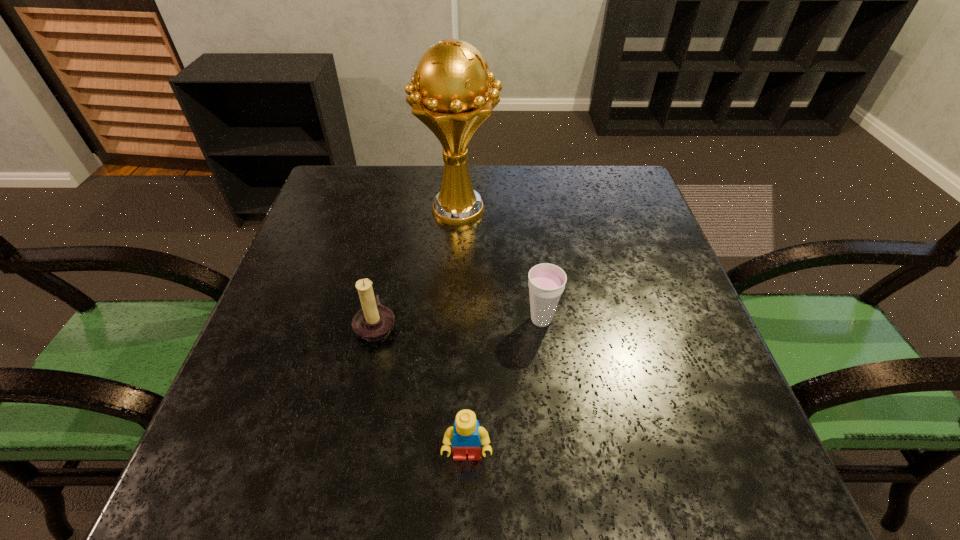
I want to click on vacant space at the far edge of the desktop, so click(491, 204).

The height and width of the screenshot is (540, 960). In the image, there is a desktop. Identify the location of free space at the near edge. (637, 480).

Find the location of a particular element. The width and height of the screenshot is (960, 540). blank area at the left edge is located at coordinates (367, 230).

Image resolution: width=960 pixels, height=540 pixels. In the image, there is a desktop. Find the location of `vacant space at the right edge`. vacant space at the right edge is located at coordinates (729, 433).

The height and width of the screenshot is (540, 960). Identify the location of blank space at the near left corner of the desktop. (259, 448).

Where is `empty space that is in between the leftmost object and the tallest object`? The width and height of the screenshot is (960, 540). empty space that is in between the leftmost object and the tallest object is located at coordinates (418, 267).

Where is `vacant space that's between the leftmost object and the trophy_cup`? The height and width of the screenshot is (540, 960). vacant space that's between the leftmost object and the trophy_cup is located at coordinates (418, 267).

Where is `unoccupied area between the rightmost object and the Lego`? This screenshot has height=540, width=960. unoccupied area between the rightmost object and the Lego is located at coordinates pos(504,388).

Locate an element on the screen. This screenshot has height=540, width=960. empty location between the rightmost object and the Lego is located at coordinates (504, 388).

Where is `vacant space that is in between the nearest object and the candle holder`? vacant space that is in between the nearest object and the candle holder is located at coordinates (421, 390).